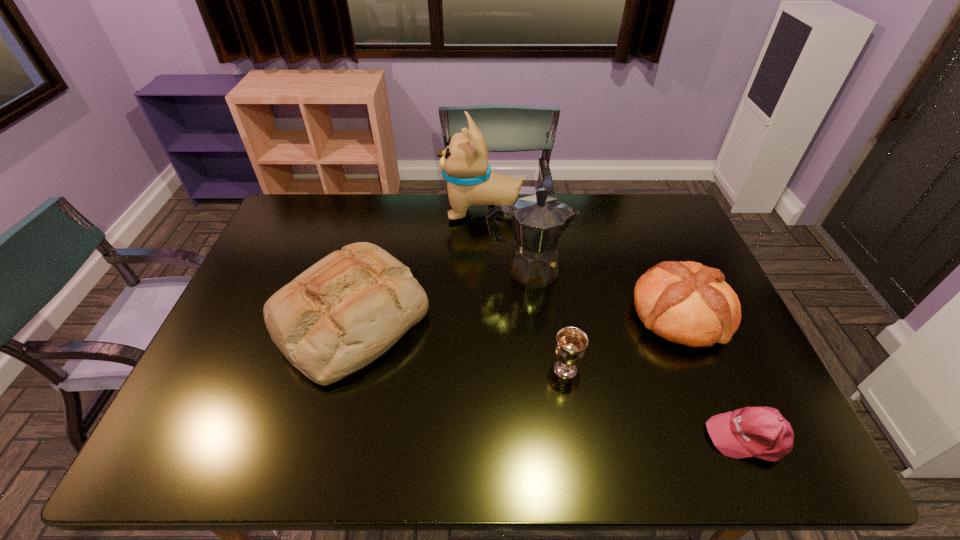
I want to click on vacant space that satisfies the following two spatial constraints: 1. on the pouring side of the right bread; 2. on the left side of the coffeepot, so click(532, 314).